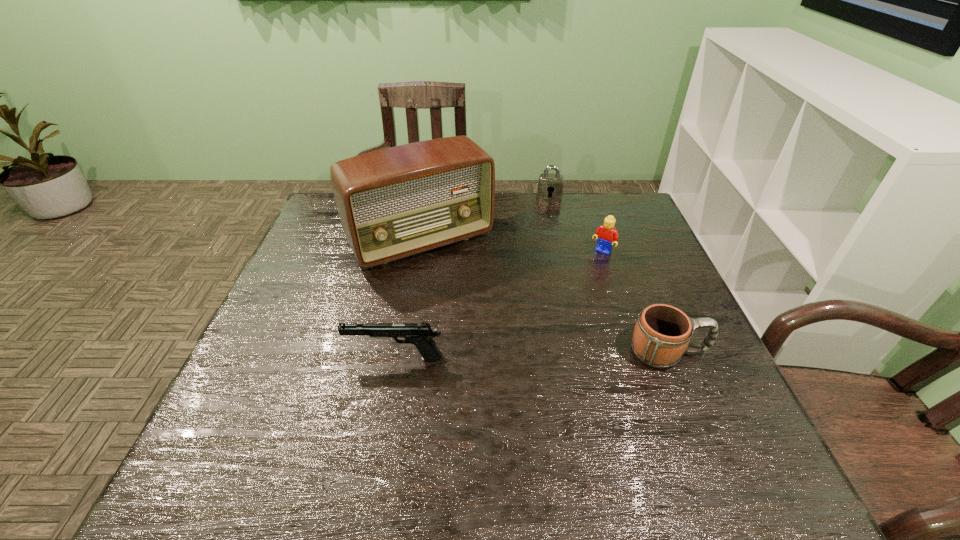
Where is `free spot between the mug and the tallest object`? The width and height of the screenshot is (960, 540). free spot between the mug and the tallest object is located at coordinates (545, 297).

This screenshot has width=960, height=540. Find the location of `vacant area that lies between the gun and the padlock`. vacant area that lies between the gun and the padlock is located at coordinates (472, 278).

The width and height of the screenshot is (960, 540). I want to click on empty space that is in between the farthest object and the gun, so pos(472,278).

The height and width of the screenshot is (540, 960). I want to click on free point between the gun and the tallest object, so click(408, 300).

The image size is (960, 540). I want to click on unoccupied area between the tallest object and the mug, so click(x=545, y=297).

This screenshot has height=540, width=960. What are the coordinates of `vacant space that's between the farthest object and the gun` in the screenshot? It's located at (472, 278).

Where is `vacant space that is in between the mug and the tallest object`? The height and width of the screenshot is (540, 960). vacant space that is in between the mug and the tallest object is located at coordinates (545, 297).

Image resolution: width=960 pixels, height=540 pixels. I want to click on vacant space that's between the mug and the Lego, so tap(636, 302).

Locate an element on the screen. This screenshot has width=960, height=540. object identified as the second closest to the Lego is located at coordinates (396, 202).

Find the location of `object that can be found as the fourth closest to the mug`. object that can be found as the fourth closest to the mug is located at coordinates (550, 186).